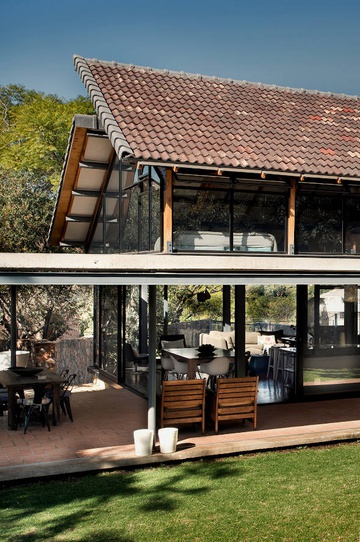
Locate an element on the screen. bed is located at coordinates (209, 241).